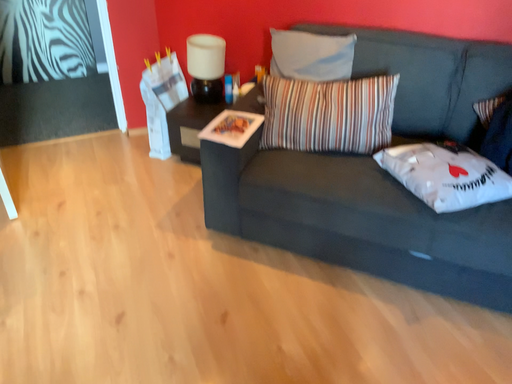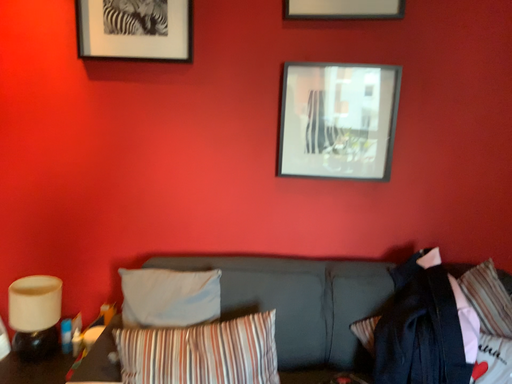
Question: Which way did the camera rotate in the video?

Choices:
 (A) rotated right
 (B) rotated left

Answer: (A)